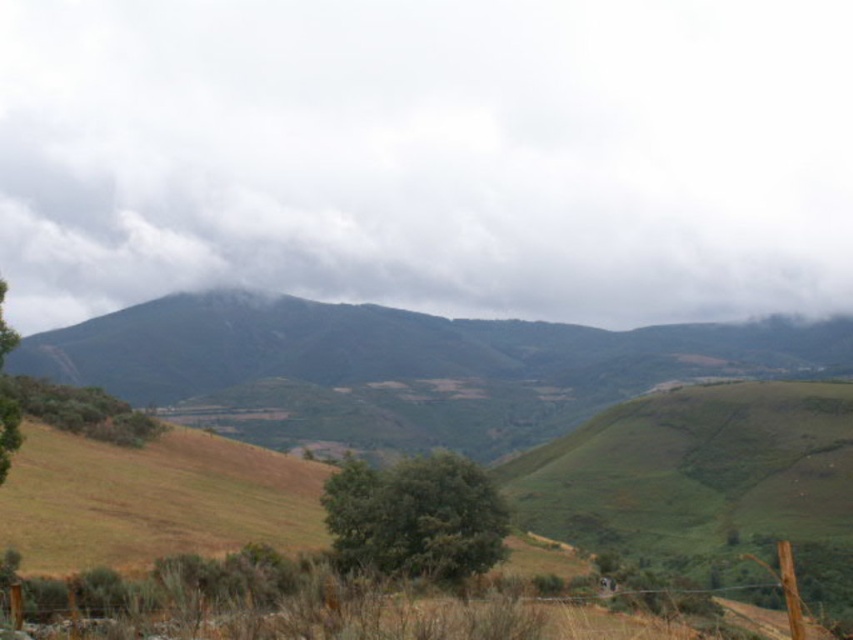
Question: Can you confirm if green leafy tree at center is wider than green leafy tree at left?

Choices:
 (A) yes
 (B) no

Answer: (B)

Question: Which is nearer to the green leafy tree at center?

Choices:
 (A) brown wooden fence at lower center
 (B) white fluffy cloud at upper center
 (C) green leafy tree at lower left
 (D) green grassy mountain at center

Answer: (A)

Question: Based on their relative distances, which object is farther from the green leafy tree at center?

Choices:
 (A) white fluffy cloud at upper center
 (B) green leafy tree at left
 (C) green leafy tree at lower left

Answer: (A)

Question: Is green grassy mountain at center smaller than green leafy tree at left?

Choices:
 (A) yes
 (B) no

Answer: (B)

Question: Does green leafy tree at center appear on the right side of green leafy tree at left?

Choices:
 (A) yes
 (B) no

Answer: (A)

Question: Which of the following is the farthest from the observer?

Choices:
 (A) white fluffy cloud at upper center
 (B) brown wooden fence at lower center
 (C) green leafy tree at lower left

Answer: (C)